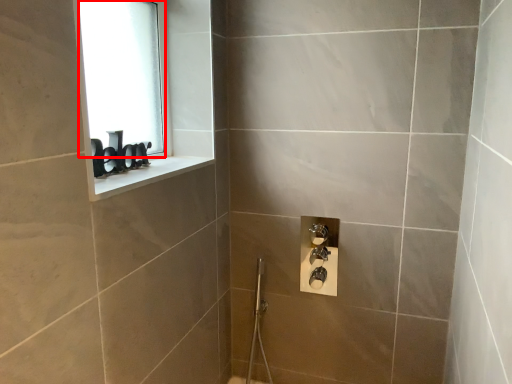
Question: From the image's perspective, considering the relative positions of window screen (annotated by the red box) and window sill in the image provided, where is window screen (annotated by the red box) located with respect to the staircase?

Choices:
 (A) below
 (B) above

Answer: (B)